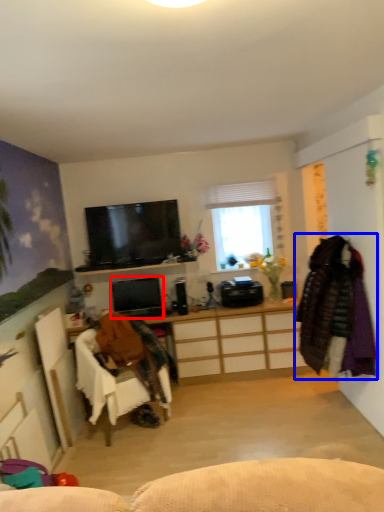
Question: Which point is closer to the camera, television (highlighted by a red box) or clothing (highlighted by a blue box)?

Choices:
 (A) television
 (B) clothing

Answer: (B)